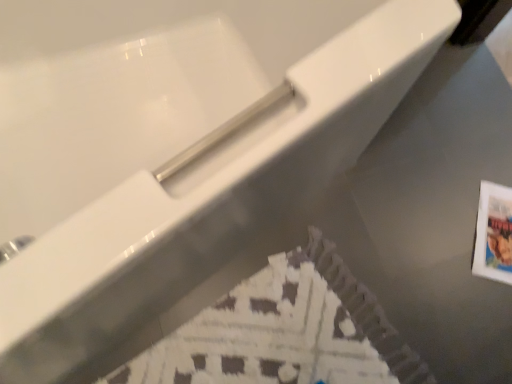
You are a GUI agent. You are given a task and a screenshot of the screen. Output one action in this format:
    pyautogui.click(x=<x>, y=<y>)
    Task: Click on the free point to the left of printed paper postcard at lower right
    
    Given the screenshot: What is the action you would take?
    pyautogui.click(x=435, y=230)